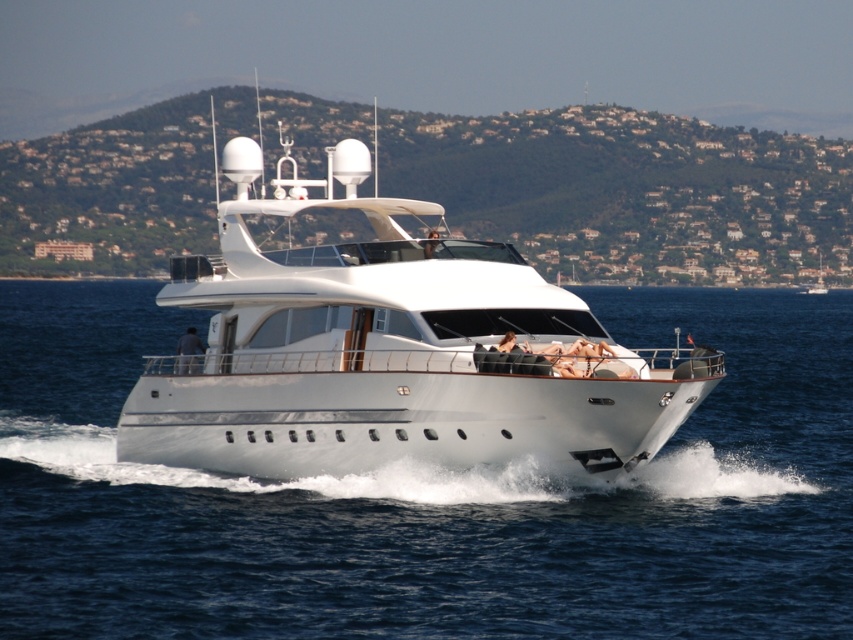
Question: Which object appears closest to the camera in this image?

Choices:
 (A) white glossy water at center
 (B) white glossy yacht at center

Answer: (A)

Question: Among these objects, which one is farthest from the camera?

Choices:
 (A) white glossy yacht at center
 (B) white glossy water at center

Answer: (A)

Question: Is white glossy water at center to the right of white glossy yacht at center from the viewer's perspective?

Choices:
 (A) no
 (B) yes

Answer: (B)

Question: Which point is farther from the camera taking this photo?

Choices:
 (A) (49, 371)
 (B) (254, 369)

Answer: (A)

Question: Can you confirm if white glossy water at center is positioned to the left of white glossy yacht at center?

Choices:
 (A) yes
 (B) no

Answer: (B)

Question: Where is white glossy water at center located in relation to white glossy yacht at center in the image?

Choices:
 (A) above
 (B) below

Answer: (B)